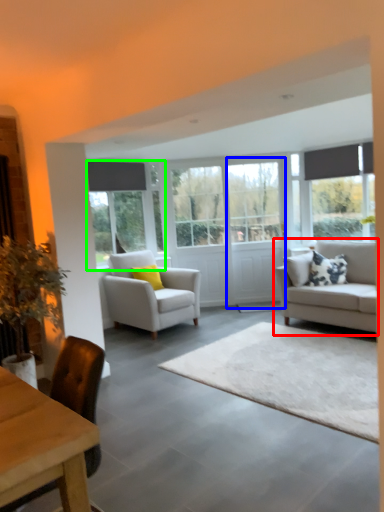
Question: Which object is positioned farthest from studio couch (highlighted by a red box)? Select from glass door (highlighted by a blue box) and window (highlighted by a green box).

Choices:
 (A) glass door
 (B) window

Answer: (B)